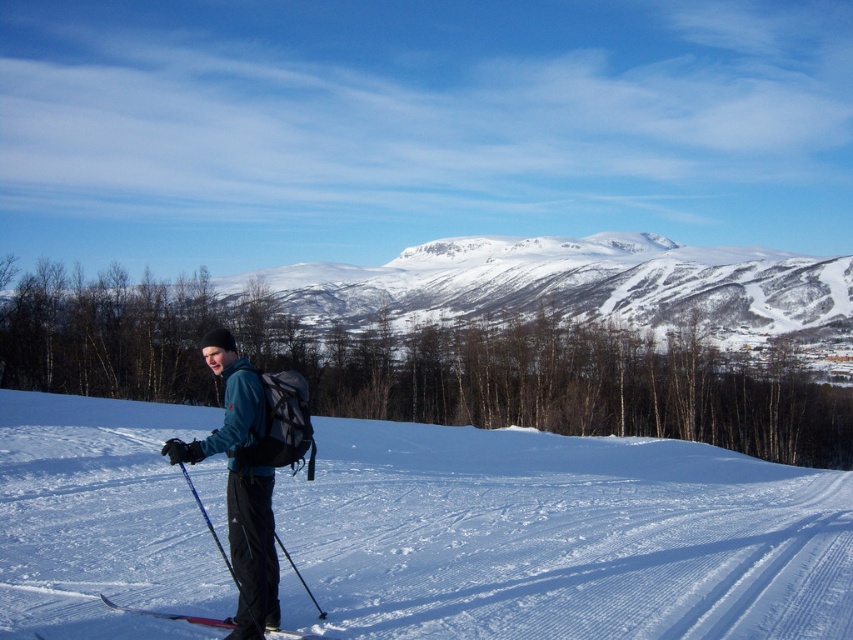
Question: Can you confirm if snowy mountain at center is positioned to the right of matte blue jacket at center?

Choices:
 (A) no
 (B) yes

Answer: (B)

Question: Which object is farther from the camera taking this photo?

Choices:
 (A) snowy mountain at center
 (B) metallic skis at lower center

Answer: (A)

Question: Considering the real-world distances, which object is farthest from the white powder snow at center?

Choices:
 (A) snowy mountain at center
 (B) metallic skis at lower center

Answer: (A)

Question: Is white powder snow at center positioned in front of matte blue jacket at center?

Choices:
 (A) yes
 (B) no

Answer: (B)

Question: Which object is the closest to the metallic skis at lower center?

Choices:
 (A) matte blue jacket at center
 (B) white powder snow at center
 (C) snowy mountain at center

Answer: (A)

Question: Can you confirm if snowy mountain at center is positioned below metallic skis at lower center?

Choices:
 (A) yes
 (B) no

Answer: (B)